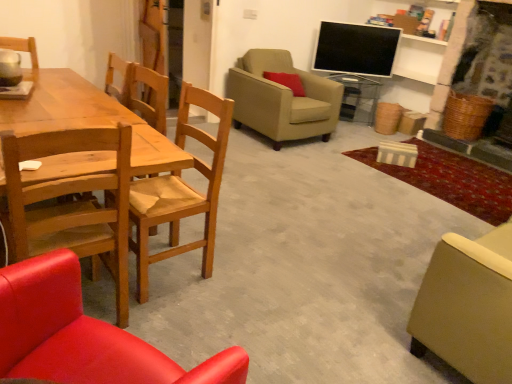
Question: Considering the relative sizes of wooden chair at left, which is counted as the fourth chair, starting from the front, and matte beige armchair at lower right, the third chair viewed from the back, in the image provided, is wooden chair at left, which is counted as the fourth chair, starting from the front, thinner than matte beige armchair at lower right, the third chair viewed from the back,?

Choices:
 (A) yes
 (B) no

Answer: (A)

Question: Is wooden chair at left, which appears as the second chair when viewed from the back, positioned in front of matte beige armchair at lower right, acting as the third chair starting from the front?

Choices:
 (A) no
 (B) yes

Answer: (A)

Question: Is matte beige armchair at lower right, the third chair viewed from the back, at the back of wooden chair at left, which is counted as the fourth chair, starting from the front?

Choices:
 (A) no
 (B) yes

Answer: (A)

Question: Is wooden chair at left, which appears as the second chair when viewed from the back, bigger than matte beige armchair at lower right, the third chair viewed from the back?

Choices:
 (A) no
 (B) yes

Answer: (A)

Question: From a real-world perspective, is wooden chair at left, which appears as the second chair when viewed from the back, physically above matte beige armchair at lower right, acting as the third chair starting from the front?

Choices:
 (A) yes
 (B) no

Answer: (A)

Question: Is wooden chair at left, the second chair viewed from the front, wider or thinner than wooden chair at left, which is counted as the fourth chair, starting from the front?

Choices:
 (A) wide
 (B) thin

Answer: (A)

Question: Is point (108, 193) positioned closer to the camera than point (212, 162)?

Choices:
 (A) closer
 (B) farther

Answer: (B)

Question: Choose the correct answer: Is wooden chair at left, the second chair viewed from the front, inside wooden chair at left, which is counted as the fourth chair, starting from the front, or outside it?

Choices:
 (A) outside
 (B) inside

Answer: (A)

Question: Is wooden chair at left, the second chair viewed from the front, taller or shorter than wooden chair at left, which appears as the second chair when viewed from the back?

Choices:
 (A) short
 (B) tall

Answer: (B)

Question: Is wooden chair at left, which appears as the second chair when viewed from the back, inside the boundaries of matte red pillow at upper center, or outside?

Choices:
 (A) inside
 (B) outside

Answer: (B)

Question: Is point (137, 180) closer or farther from the camera than point (275, 76)?

Choices:
 (A) closer
 (B) farther

Answer: (A)

Question: In terms of size, does wooden chair at left, which appears as the second chair when viewed from the back, appear bigger or smaller than matte red pillow at upper center?

Choices:
 (A) small
 (B) big

Answer: (B)

Question: Relative to matte red pillow at upper center, is wooden chair at left, which is counted as the fourth chair, starting from the front, in front or behind?

Choices:
 (A) behind
 (B) front

Answer: (B)

Question: From a real-world perspective, is matte red pillow at upper center above or below wooden chair at left, the second chair viewed from the front?

Choices:
 (A) above
 (B) below

Answer: (A)

Question: In terms of height, does matte red pillow at upper center look taller or shorter compared to wooden chair at left, the second chair viewed from the front?

Choices:
 (A) tall
 (B) short

Answer: (B)